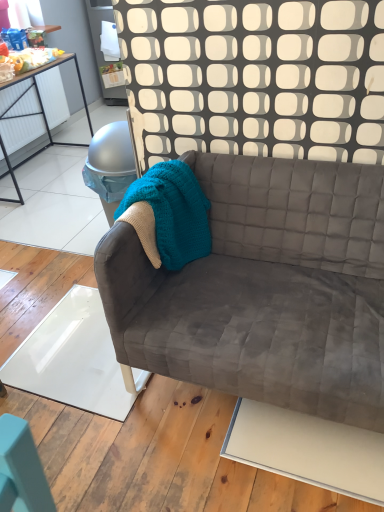
What do you see at coordinates (265, 289) in the screenshot?
I see `velvet gray couch at center` at bounding box center [265, 289].

You are a GUI agent. You are given a task and a screenshot of the screen. Output one action in this format:
    pyautogui.click(x=<x>, y=<y>)
    Task: Click on the velvet gray couch at center
    The height and width of the screenshot is (512, 384).
    Given the screenshot: What is the action you would take?
    pyautogui.click(x=265, y=289)

Image resolution: width=384 pixels, height=512 pixels. What do you see at coordinates (170, 214) in the screenshot? I see `teal knitted blanket at center` at bounding box center [170, 214].

Find the location of a particular element. teal knitted blanket at center is located at coordinates (170, 214).

In order to click on velvet gray couch at center in this screenshot , I will do `click(265, 289)`.

Based on the photo, is teal knitted blanket at center to the left of velvet gray couch at center from the viewer's perspective?

Correct, you'll find teal knitted blanket at center to the left of velvet gray couch at center.

Which is behind, teal knitted blanket at center or velvet gray couch at center?

teal knitted blanket at center is behind.

Which point is more distant from viewer, (153, 203) or (262, 236)?

Positioned behind is point (262, 236).

From the image's perspective, is teal knitted blanket at center over velvet gray couch at center?

Yes.

From a real-world perspective, who is located lower, teal knitted blanket at center or velvet gray couch at center?

velvet gray couch at center is physically lower.

Which object is thinner, teal knitted blanket at center or velvet gray couch at center?

With smaller width is teal knitted blanket at center.

Considering the sizes of teal knitted blanket at center and velvet gray couch at center in the image, is teal knitted blanket at center taller or shorter than velvet gray couch at center?

teal knitted blanket at center is shorter than velvet gray couch at center.

Based on their sizes in the image, would you say teal knitted blanket at center is bigger or smaller than velvet gray couch at center?

Clearly, teal knitted blanket at center is smaller in size than velvet gray couch at center.

In the scene shown: Is teal knitted blanket at center situated inside velvet gray couch at center or outside?

teal knitted blanket at center is spatially positioned inside velvet gray couch at center.

Is teal knitted blanket at center next to velvet gray couch at center and touching it?

teal knitted blanket at center and velvet gray couch at center are clearly separated.

Is teal knitted blanket at center oriented away from velvet gray couch at center?

Correct, teal knitted blanket at center is looking away from velvet gray couch at center.

Can you tell me how much teal knitted blanket at center and velvet gray couch at center differ in facing direction?

90.5 degrees separate the facing orientations of teal knitted blanket at center and velvet gray couch at center.

Identify the location of studio couch below the teal knitted blanket at center (from the image's perspective). The image size is (384, 512). (265, 289).

Considering the positions of objects velvet gray couch at center and teal knitted blanket at center in the image provided, who is more to the left, velvet gray couch at center or teal knitted blanket at center?

From the viewer's perspective, teal knitted blanket at center appears more on the left side.

Which object is further away from the camera, velvet gray couch at center or teal knitted blanket at center?

Positioned behind is teal knitted blanket at center.

Is point (131, 241) closer to viewer compared to point (169, 196)?

Yes.

From the image's perspective, which one is positioned higher, velvet gray couch at center or teal knitted blanket at center?

A: teal knitted blanket at center, from the image's perspective.

From a real-world perspective, which object rests below the other?

velvet gray couch at center, from a real-world perspective.

Considering the relative sizes of velvet gray couch at center and teal knitted blanket at center in the image provided, is velvet gray couch at center thinner than teal knitted blanket at center?

Incorrect, the width of velvet gray couch at center is not less than that of teal knitted blanket at center.

Between velvet gray couch at center and teal knitted blanket at center, which one has less height?

Standing shorter between the two is teal knitted blanket at center.

Consider the image. Considering the relative sizes of velvet gray couch at center and teal knitted blanket at center in the image provided, is velvet gray couch at center bigger than teal knitted blanket at center?

Yes.

Is velvet gray couch at center located outside teal knitted blanket at center?

velvet gray couch at center lies outside teal knitted blanket at center's area.

Does velvet gray couch at center touch teal knitted blanket at center?

No, velvet gray couch at center is not making contact with teal knitted blanket at center.

From the picture: Is velvet gray couch at center oriented towards teal knitted blanket at center?

No, velvet gray couch at center is not facing towards teal knitted blanket at center.

How many degrees apart are the facing directions of velvet gray couch at center and teal knitted blanket at center?

90.5 degrees separate the facing orientations of velvet gray couch at center and teal knitted blanket at center.

Locate an element on the screen. This screenshot has height=512, width=384. blanket that is behind the velvet gray couch at center is located at coordinates pyautogui.click(x=170, y=214).

Identify the location of studio couch that is below the teal knitted blanket at center (from the image's perspective). This screenshot has height=512, width=384. (265, 289).

This screenshot has width=384, height=512. In the image, there is a velvet gray couch at center. In order to click on blanket above it (from the image's perspective) in this screenshot , I will do (x=170, y=214).